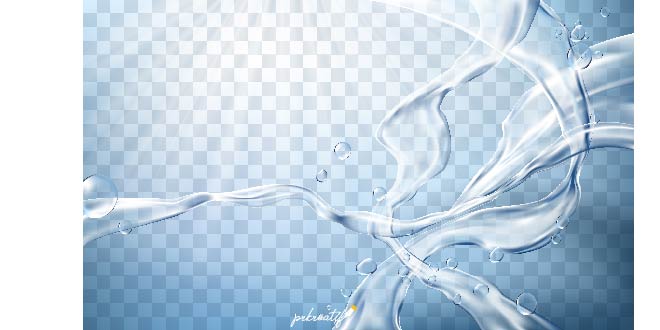
The height and width of the screenshot is (330, 660). I want to click on corners, so click(636, 326), click(82, 328), click(82, 3), click(632, 0).